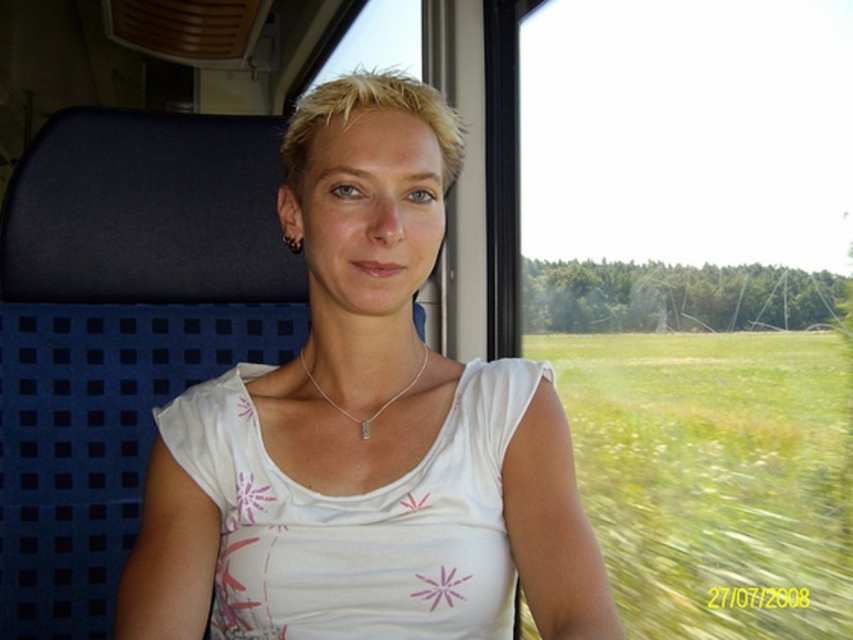
Question: Can you confirm if white fabric at center is positioned below silver metallic necklace at center?

Choices:
 (A) no
 (B) yes

Answer: (A)

Question: Which of the following is the farthest from the observer?

Choices:
 (A) (252, 493)
 (B) (415, 376)

Answer: (B)

Question: Which point is closer to the camera?

Choices:
 (A) white fabric at center
 (B) silver metallic necklace at center

Answer: (A)

Question: In this image, where is white fabric at center located relative to silver metallic necklace at center?

Choices:
 (A) right
 (B) left

Answer: (A)

Question: Does white fabric at center appear on the left side of silver metallic necklace at center?

Choices:
 (A) yes
 (B) no

Answer: (B)

Question: Which point is farther to the camera?

Choices:
 (A) (368, 426)
 (B) (369, 173)

Answer: (A)